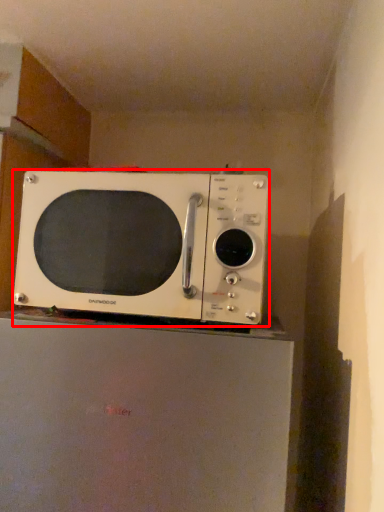
Question: From the image's perspective, considering the relative positions of microwave oven (annotated by the red box) and appliance in the image provided, where is microwave oven (annotated by the red box) located with respect to the staircase?

Choices:
 (A) above
 (B) below

Answer: (A)